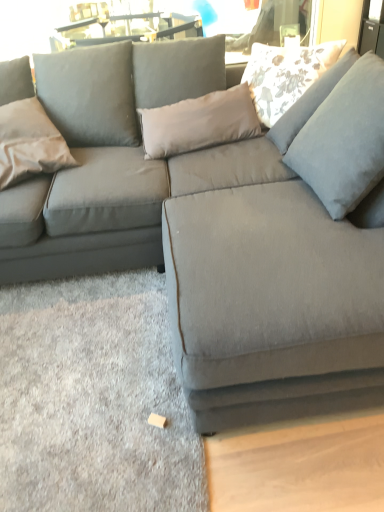
Question: From a real-world perspective, is satin beige pillow at left, the first pillow in the left-to-right sequence, above or below floral fabric pillow at upper right, which is counted as the 1th pillow, starting from the top?

Choices:
 (A) above
 (B) below

Answer: (B)

Question: Is point (52, 138) closer or farther from the camera than point (304, 74)?

Choices:
 (A) closer
 (B) farther

Answer: (A)

Question: Looking at the image, does satin beige pillow at left, acting as the first pillow starting from the bottom, seem bigger or smaller compared to floral fabric pillow at upper right, the first pillow when ordered from right to left?

Choices:
 (A) big
 (B) small

Answer: (B)

Question: Does point (278, 91) appear closer or farther from the camera than point (49, 123)?

Choices:
 (A) farther
 (B) closer

Answer: (A)

Question: From the image's perspective, is floral fabric pillow at upper right, the first pillow when ordered from right to left, located above or below satin beige pillow at left, the 2th pillow from the top?

Choices:
 (A) above
 (B) below

Answer: (A)

Question: In terms of height, does floral fabric pillow at upper right, the second pillow positioned from the left, look taller or shorter compared to satin beige pillow at left, positioned as the second pillow in right-to-left order?

Choices:
 (A) tall
 (B) short

Answer: (B)

Question: Is floral fabric pillow at upper right, the second pillow positioned from the left, to the left or to the right of satin beige pillow at left, acting as the first pillow starting from the bottom, in the image?

Choices:
 (A) left
 (B) right

Answer: (B)